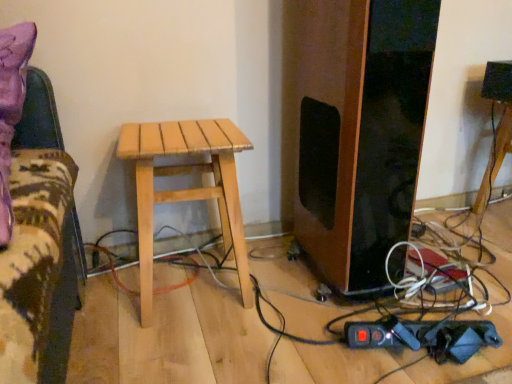
Where is `vacant point to the right of natural wood stool at center`? vacant point to the right of natural wood stool at center is located at coordinates (286, 287).